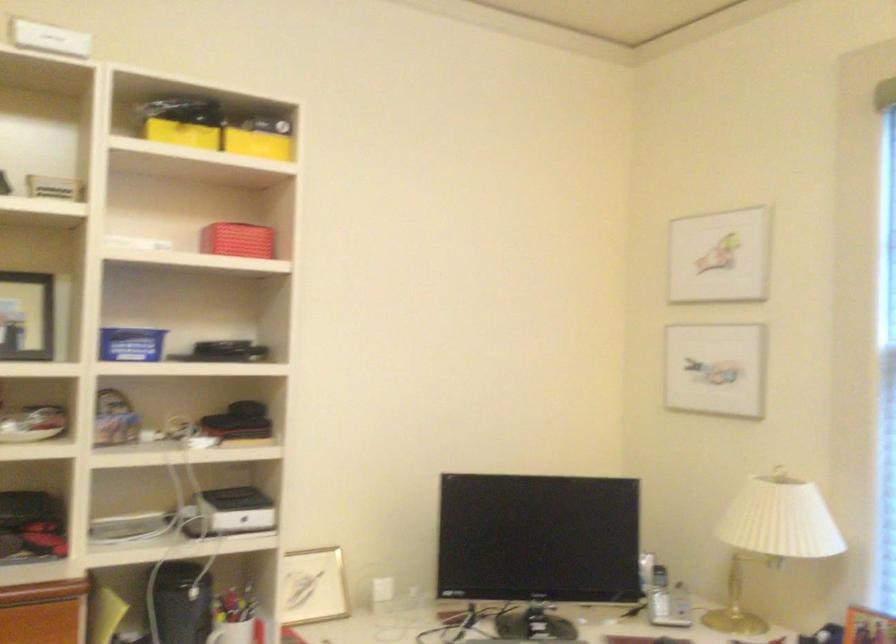
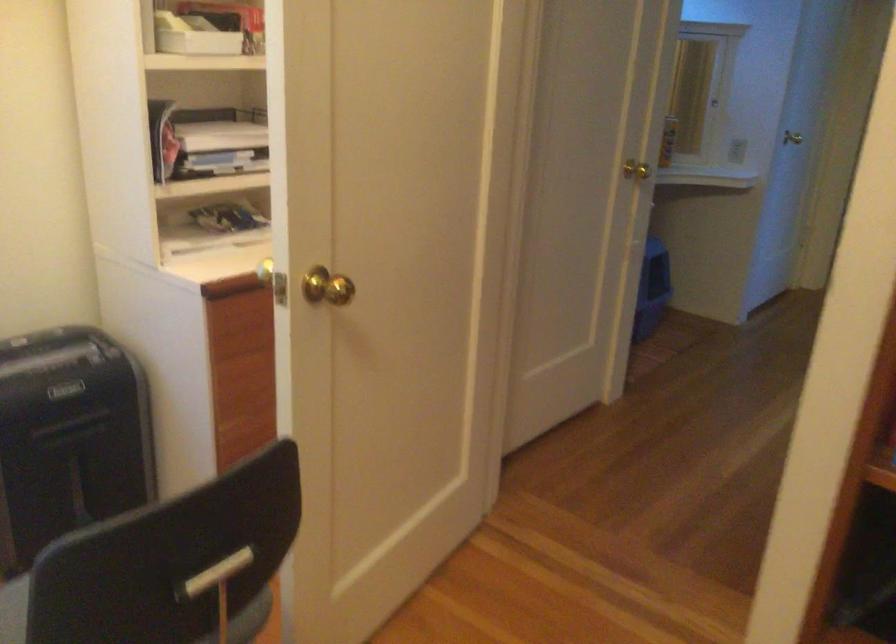
Looking at this image, the images are taken continuously from a first-person perspective. In which direction is your viewpoint rotating?

The camera rotated toward right-down.